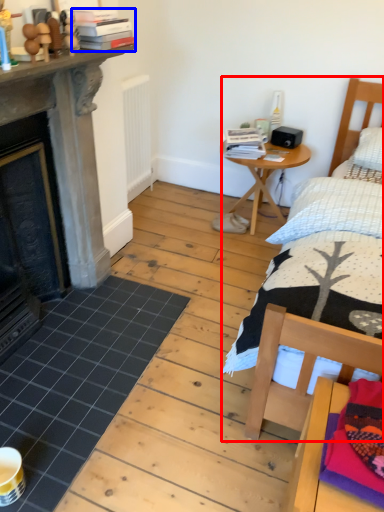
Question: Among these objects, which one is nearest to the camera, bed (highlighted by a red box) or book (highlighted by a blue box)?

Choices:
 (A) bed
 (B) book

Answer: (A)